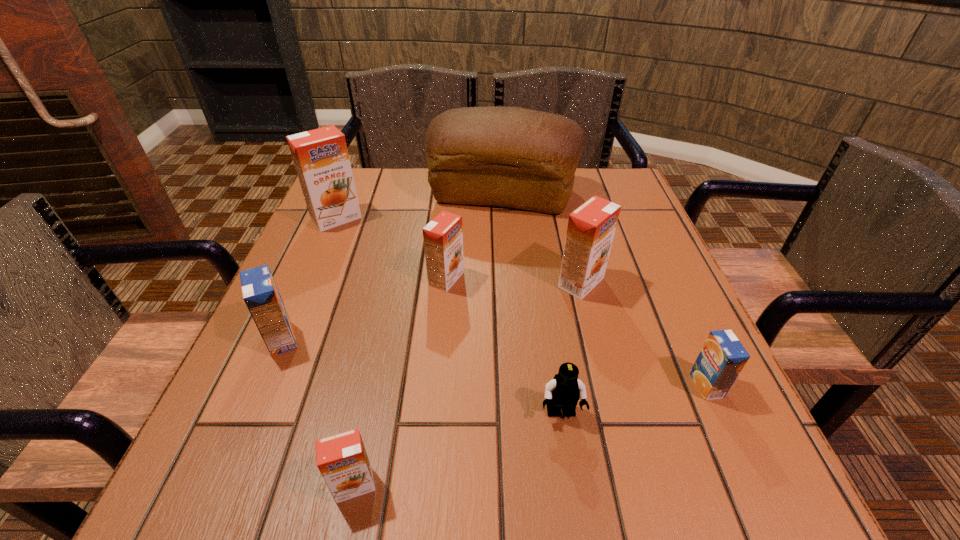
The width and height of the screenshot is (960, 540). What are the coordinates of `vacant point located between the third nearest object and the smallest orange orange juice` in the screenshot? It's located at (530, 435).

What are the coordinates of `object that is the fourth closest to the fifth orange juice from left to right` in the screenshot? It's located at [564, 390].

The height and width of the screenshot is (540, 960). Find the location of `object that stands as the third closest to the Lego`. object that stands as the third closest to the Lego is located at coordinates (342, 460).

Identify the location of the third closest orange juice relative to the farther blue orange_juice. (321, 159).

What are the coordinates of `orange juice that is the fifth closest to the farthest orange juice` in the screenshot? It's located at (722, 357).

You are a GUI agent. You are given a task and a screenshot of the screen. Output one action in this format:
    pyautogui.click(x=<x>, y=<y>)
    Task: Click on the orange orange juice that is the second closest one to the rightmost orange juice
    This screenshot has height=540, width=960.
    Given the screenshot: What is the action you would take?
    pyautogui.click(x=443, y=236)

At what (x,y) coordinates should I click in order to perform the action: click on orange orange juice that is the third closest to the second smallest orange orange juice. Please return your answer as a coordinate pair (x, y). Image resolution: width=960 pixels, height=540 pixels. Looking at the image, I should click on (342, 460).